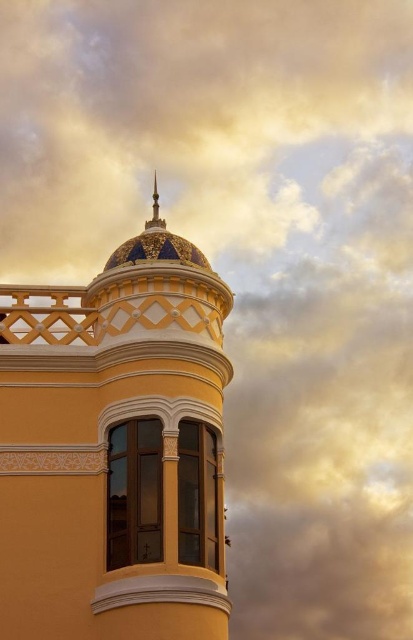
Question: Does matte yellow bell tower at center have a lesser width compared to gold metallic spire at upper center?

Choices:
 (A) no
 (B) yes

Answer: (A)

Question: Is matte yellow bell tower at center below gold metallic spire at upper center?

Choices:
 (A) no
 (B) yes

Answer: (B)

Question: Is the position of matte yellow bell tower at center less distant than that of gold metallic spire at upper center?

Choices:
 (A) yes
 (B) no

Answer: (A)